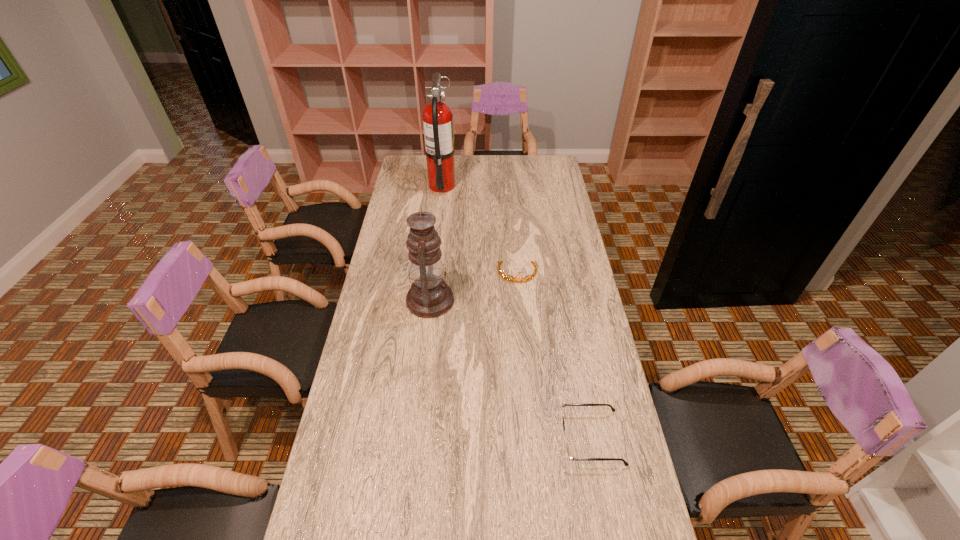
Find the location of a particular element. fire extinguisher is located at coordinates (438, 126).

Find the location of a particular element. This screenshot has width=960, height=540. the tallest object is located at coordinates (438, 126).

Locate an element on the screen. oil lamp is located at coordinates (429, 296).

Locate an element on the screen. This screenshot has height=540, width=960. the third object from left to right is located at coordinates (503, 275).

At what (x,y) coordinates should I click in order to perform the action: click on the second shortest object. Please return your answer as a coordinate pair (x, y). Image resolution: width=960 pixels, height=540 pixels. Looking at the image, I should click on (503, 275).

Where is `the rightmost object`? This screenshot has width=960, height=540. the rightmost object is located at coordinates (569, 455).

I want to click on spectacles, so click(x=569, y=455).

What are the coordinates of `free space located 0.130m on the nozzle side of the fire extinguisher` in the screenshot? It's located at (482, 186).

Locate an element on the screen. The width and height of the screenshot is (960, 540). blank area located on the right of the oil lamp is located at coordinates (564, 300).

This screenshot has width=960, height=540. In order to click on free location located on the front-facing side of the tiara in this screenshot , I will do click(x=526, y=372).